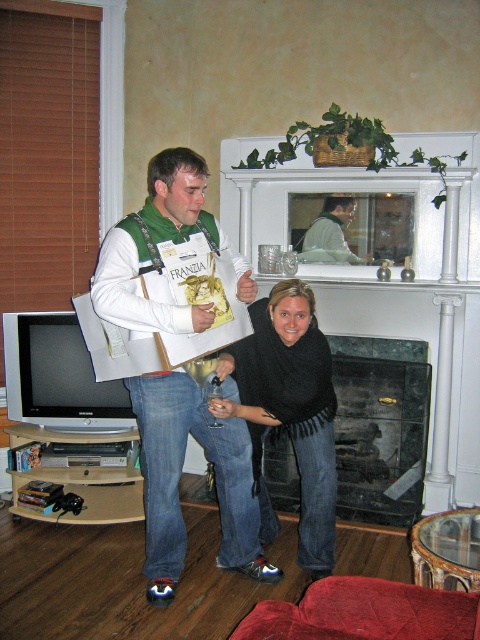
Does green marble fireplace at upper center have a greater width compared to black knitwear at center?

Indeed, green marble fireplace at upper center has a greater width compared to black knitwear at center.

Does point (453, 301) come behind point (292, 435)?

That is True.

In order to click on green marble fireplace at upper center in this screenshot , I will do `click(391, 278)`.

Can you confirm if matte green vest at center is taller than black knitwear at center?

Correct, matte green vest at center is much taller as black knitwear at center.

Is point (166, 548) positioned behind point (314, 493)?

That is False.

The image size is (480, 640). Identify the location of matte green vest at center. (179, 480).

You are a GUI agent. You are given a task and a screenshot of the screen. Output one action in this format:
    pyautogui.click(x=<x>, y=<y>)
    Task: Click on the matte green vest at center
    
    Given the screenshot: What is the action you would take?
    pyautogui.click(x=179, y=480)

Does black knitwear at center have a lesser height compared to black marble fireplace at center?

No, black knitwear at center is not shorter than black marble fireplace at center.

Between black knitwear at center and black marble fireplace at center, which one has less height?

With less height is black marble fireplace at center.

Locate an element on the screen. The width and height of the screenshot is (480, 640). black knitwear at center is located at coordinates (288, 412).